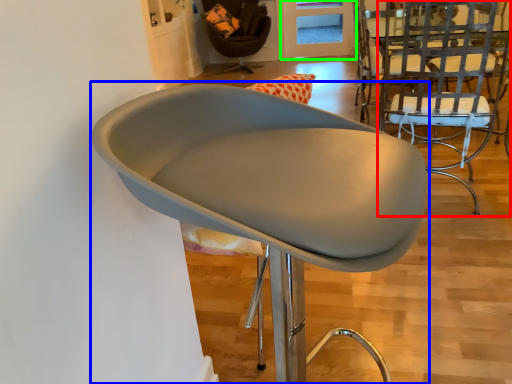
Question: Considering the real-world distances, which object is farthest from chair (highlighted by a red box)? chair (highlighted by a blue box) or glass door (highlighted by a green box)?

Choices:
 (A) chair
 (B) glass door

Answer: (B)